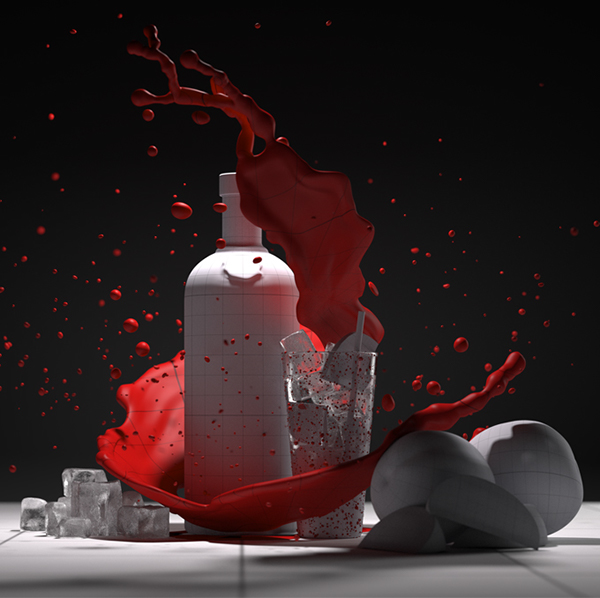
I want to click on bottle, so click(x=224, y=315).